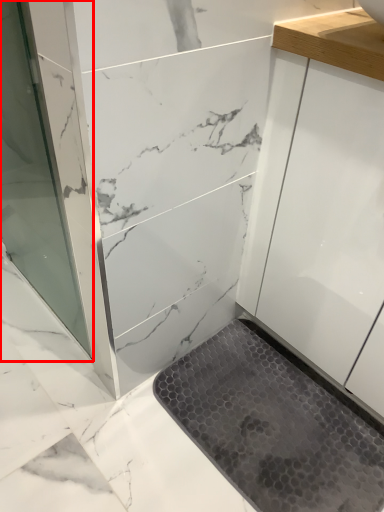
Question: From the image's perspective, what is the correct spatial relationship of screen door (annotated by the red box) in relation to bath mat?

Choices:
 (A) above
 (B) below

Answer: (A)